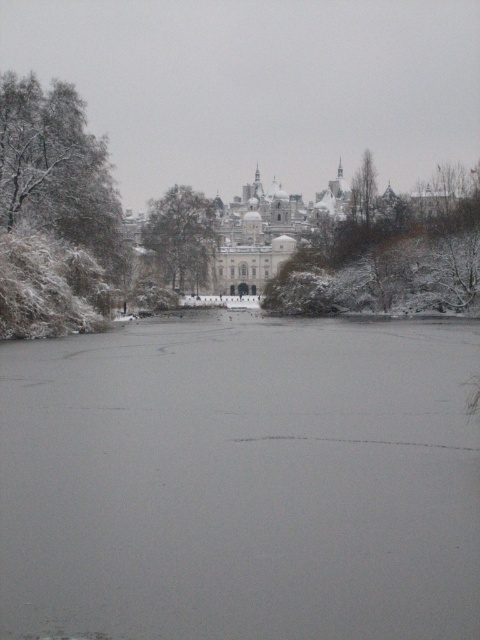
Question: Which of the following is the closest to the observer?

Choices:
 (A) (183, 259)
 (B) (384, 253)

Answer: (B)

Question: From the image, what is the correct spatial relationship of snow-covered tree at upper center in relation to snow-covered tree at center?

Choices:
 (A) left
 (B) right

Answer: (B)

Question: Is white snow-covered tree at left smaller than snow-covered tree at upper center?

Choices:
 (A) yes
 (B) no

Answer: (A)

Question: Which object is closer to the camera taking this photo?

Choices:
 (A) snow-covered tree at upper center
 (B) snow-covered tree at center
 (C) white snow-covered tree at left

Answer: (C)

Question: From the image, what is the correct spatial relationship of snow-covered tree at upper center in relation to snow-covered tree at center?

Choices:
 (A) right
 (B) left

Answer: (A)

Question: Which point is closer to the camera?

Choices:
 (A) snow-covered tree at upper center
 (B) snow-covered tree at center
 (C) white snow-covered tree at left

Answer: (C)